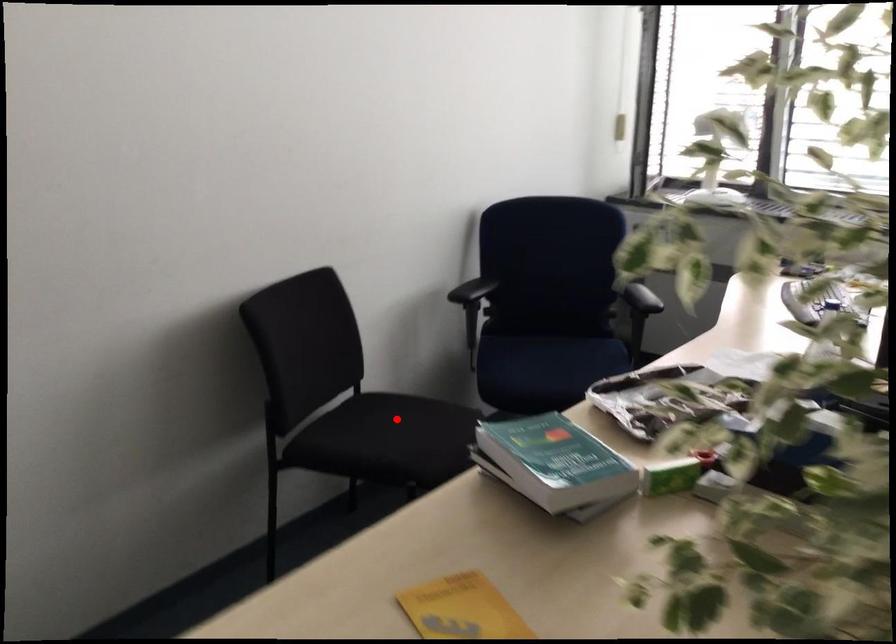
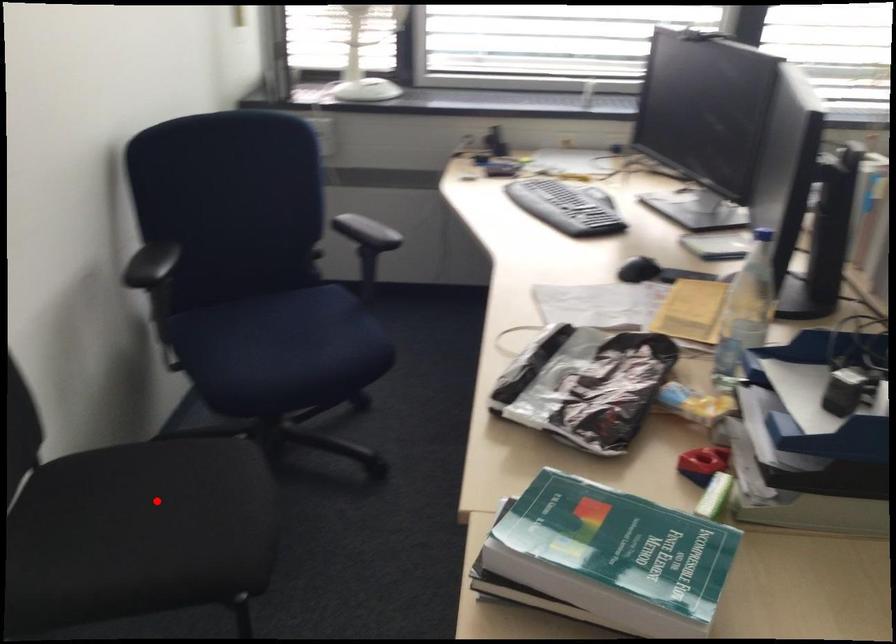
I am providing you with two images of the same scene from different viewpoints. A red point is marked on the first image and another point is marked on the second image. Are the points marked in image1 and image2 representing the same 3D position?

Yes